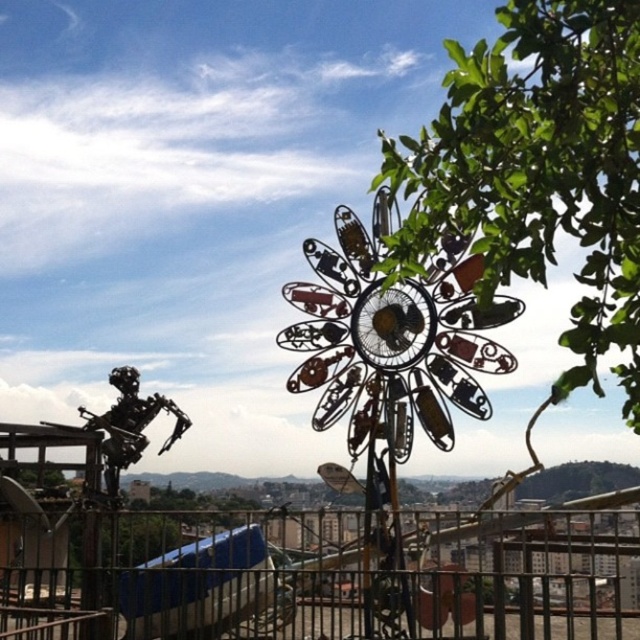
Does metallic at lower center have a greater width compared to green leafy tree at upper right?

Yes.

Identify the location of metallic at lower center. (326, 577).

Is metallic at lower center shorter than metallic robot at lower left?

No.

Where is `metallic at lower center`? metallic at lower center is located at coordinates (326, 577).

At what (x,y) coordinates should I click in order to perform the action: click on metallic at lower center. Please return your answer as a coordinate pair (x, y). This screenshot has height=640, width=640. Looking at the image, I should click on (326, 577).

Does green leafy tree at upper right appear on the left side of metallic robot at lower left?

Incorrect, green leafy tree at upper right is not on the left side of metallic robot at lower left.

Is green leafy tree at upper right further to camera compared to metallic robot at lower left?

That is False.

Is point (428, 205) in front of point (93, 419)?

That is True.

The width and height of the screenshot is (640, 640). Identify the location of green leafy tree at upper right. (540, 170).